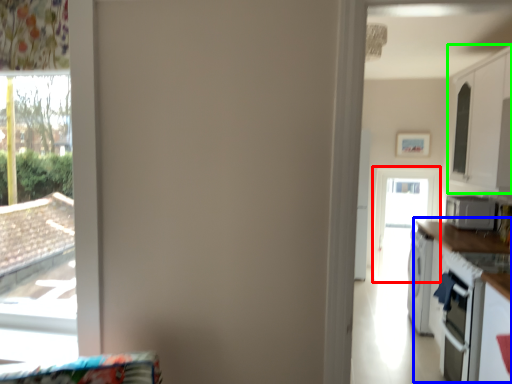
Question: Which is nearer to the screen door (highlighted by a red box)? counter top (highlighted by a blue box) or cabinetry (highlighted by a green box).

Choices:
 (A) counter top
 (B) cabinetry

Answer: (B)